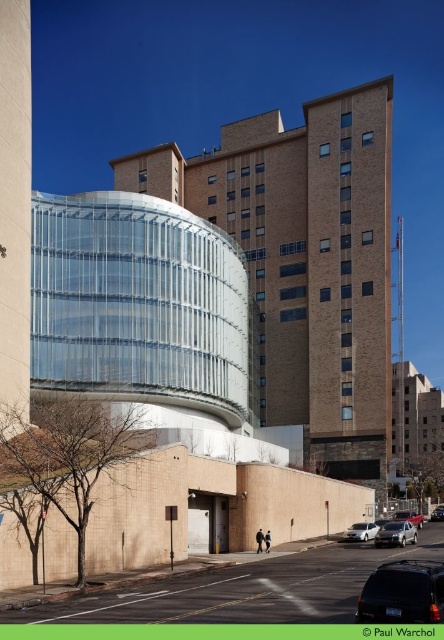
Question: Which point appears closest to the camera in this image?

Choices:
 (A) (412, 522)
 (B) (400, 621)
 (C) (400, 534)

Answer: (B)

Question: Is silver metallic sedan at lower right positioned before metallic silver sedan at center?

Choices:
 (A) yes
 (B) no

Answer: (A)

Question: Is silver metallic sedan at lower right below metallic silver sedan at center?

Choices:
 (A) yes
 (B) no

Answer: (B)

Question: Among these objects, which one is nearest to the camera?

Choices:
 (A) metallic silver sedan at center
 (B) matte black suv at lower right

Answer: (B)

Question: Which object is farther from the camera taking this photo?

Choices:
 (A) white matte car at lower center
 (B) silver metallic sedan at lower right
 (C) metallic silver sedan at center
 (D) silver metallic sedan at center

Answer: (C)

Question: Is silver metallic sedan at center wider than metallic silver sedan at center?

Choices:
 (A) yes
 (B) no

Answer: (A)